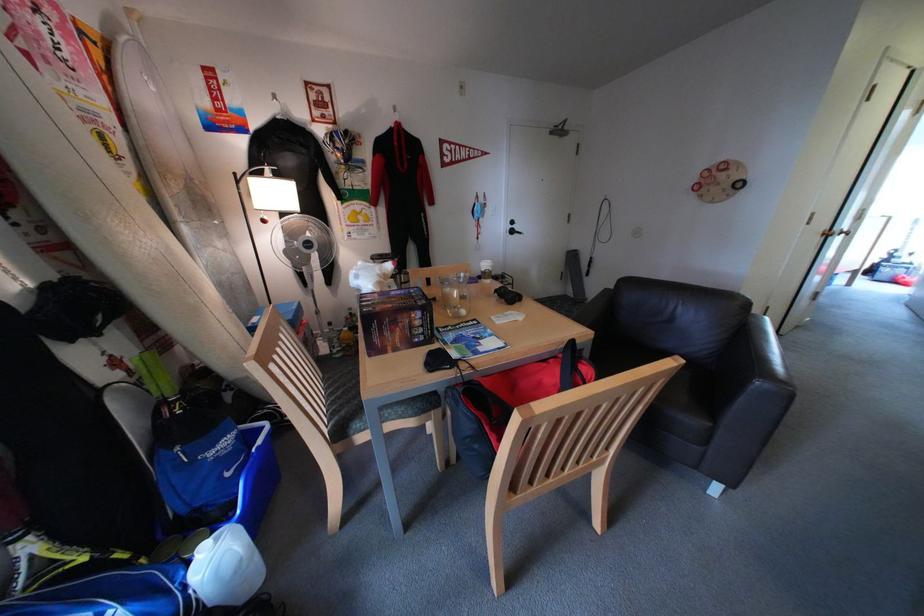
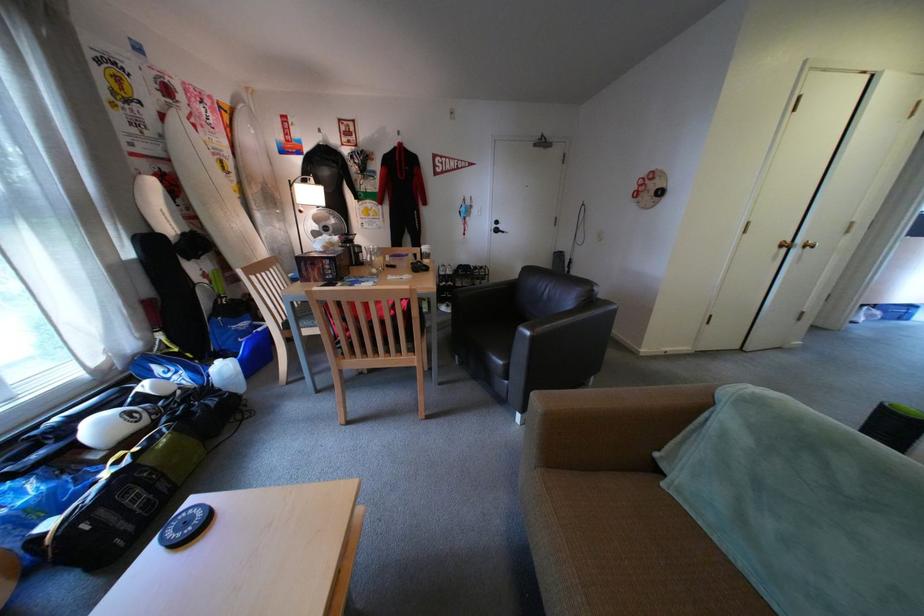
Where in the second image is the point corresponding to the point at 723,493 from the first image?

(530, 422)